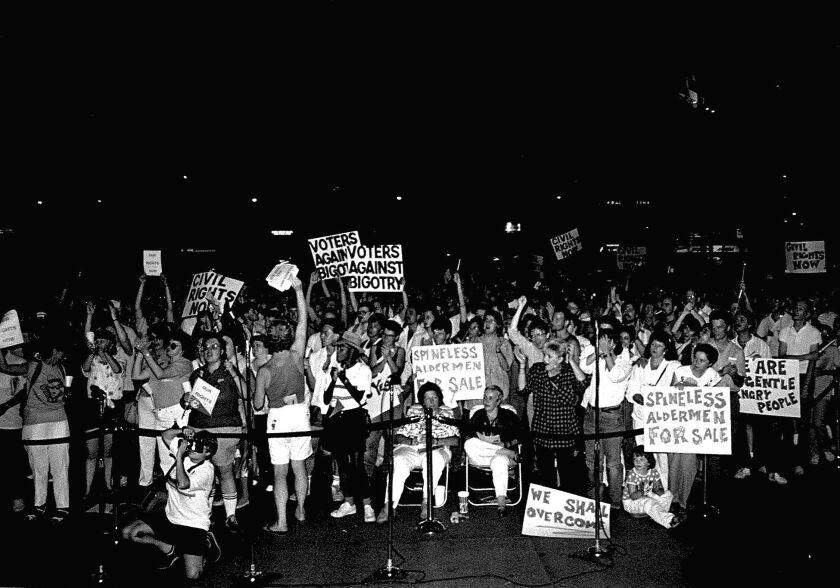
The image size is (840, 588). I want to click on chairs, so click(476, 493), click(445, 489).